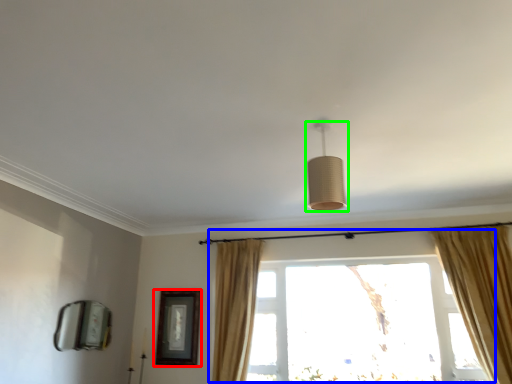
Question: Estimate the real-world distances between objects in this image. Which object is closer to picture frame (highlighted by a red box), window (highlighted by a blue box) or lamp (highlighted by a green box)?

Choices:
 (A) window
 (B) lamp

Answer: (A)